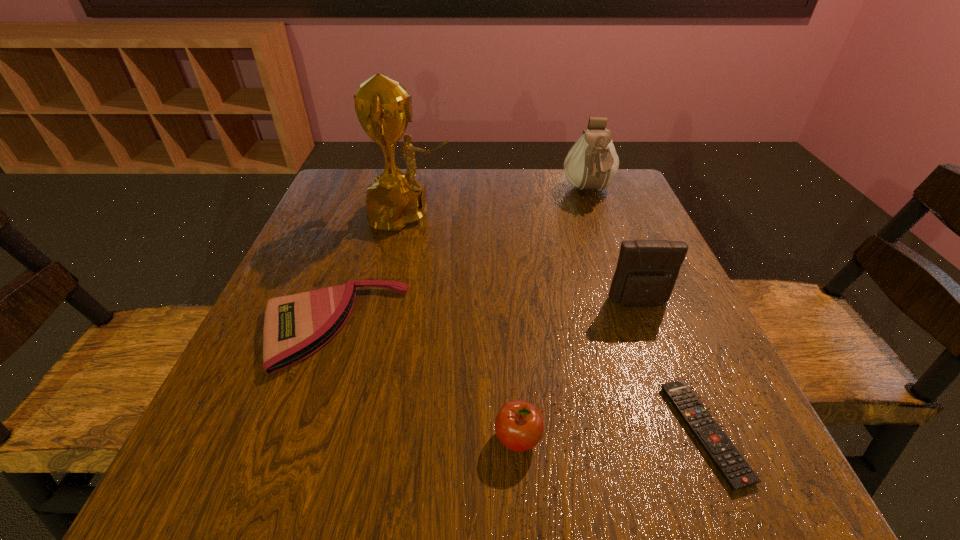
Where is `free space located on the front-facing side of the second tallest object`? Image resolution: width=960 pixels, height=540 pixels. free space located on the front-facing side of the second tallest object is located at coordinates [608, 245].

Where is `vacant area situated 0.070m with an open flap on the nearer pouch`? This screenshot has width=960, height=540. vacant area situated 0.070m with an open flap on the nearer pouch is located at coordinates (654, 341).

Where is `free spot located 0.200m on the left of the third shortest object`? This screenshot has width=960, height=540. free spot located 0.200m on the left of the third shortest object is located at coordinates (352, 438).

You are a GUI agent. You are given a task and a screenshot of the screen. Output one action in this format:
    pyautogui.click(x=<x>, y=<y>)
    Task: Click on the vacant space located on the front of the fifth tallest object
    The image size is (960, 540).
    Given the screenshot: What is the action you would take?
    pyautogui.click(x=298, y=430)

Locate an element on the screen. The image size is (960, 540). vacant point located 0.160m on the left of the shortest object is located at coordinates (563, 433).

You are a GUI agent. You are given a task and a screenshot of the screen. Output one action in this format:
    pyautogui.click(x=<x>, y=<y>)
    Task: Click on the award positioned at the far edge
    The height and width of the screenshot is (540, 960).
    Given the screenshot: What is the action you would take?
    pyautogui.click(x=383, y=107)

Image resolution: width=960 pixels, height=540 pixels. Find the location of `pouch at the far edge`. pouch at the far edge is located at coordinates pyautogui.click(x=592, y=163).

At what (x,y) coordinates should I click in order to perform the action: click on apple at the near edge. Please return your answer as a coordinate pair (x, y). The width and height of the screenshot is (960, 540). Looking at the image, I should click on (519, 425).

This screenshot has height=540, width=960. I want to click on remote control situated at the near edge, so click(x=735, y=470).

Find the location of a particular element. The height and width of the screenshot is (540, 960). award positioned at the left edge is located at coordinates (383, 107).